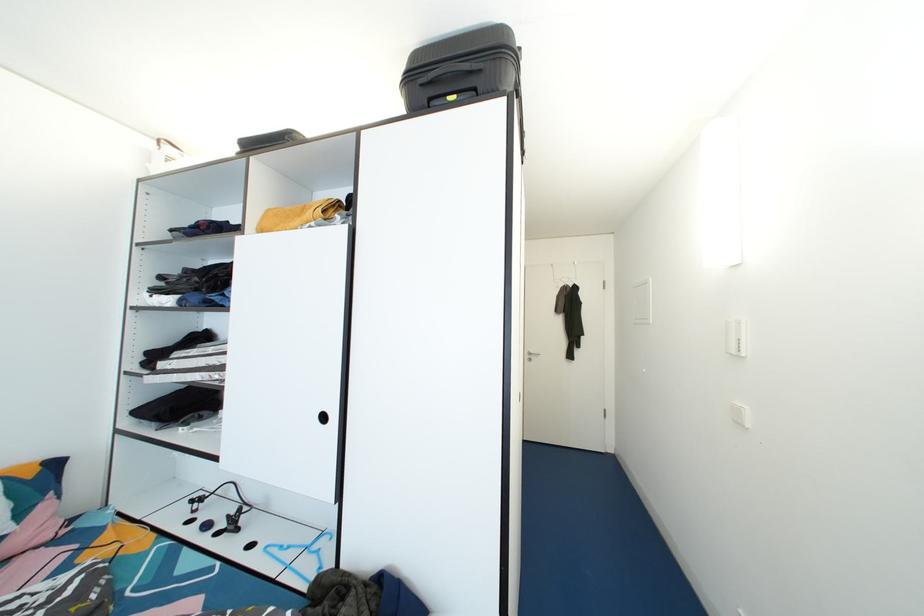
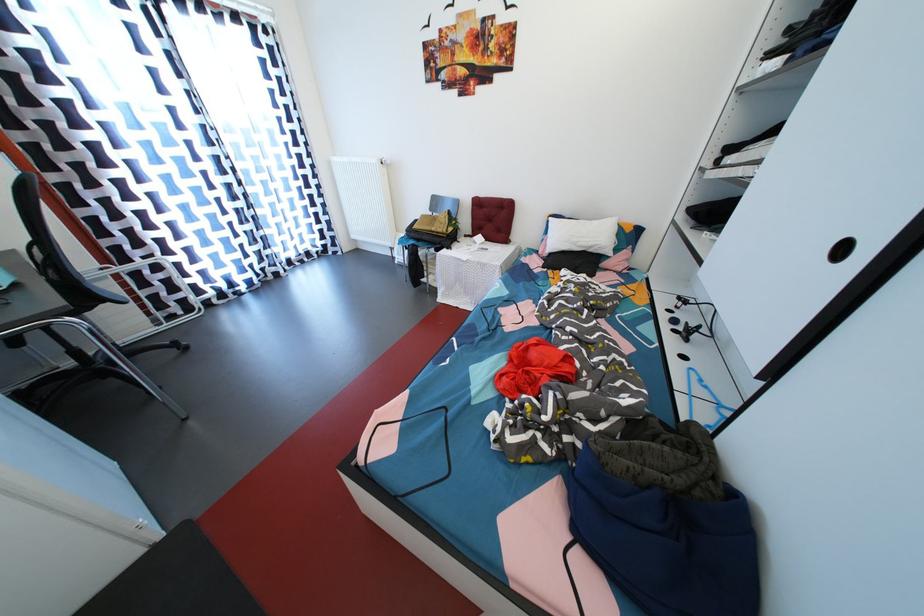
In the second image, find the point that corresponds to (x=224, y=539) in the first image.

(681, 336)